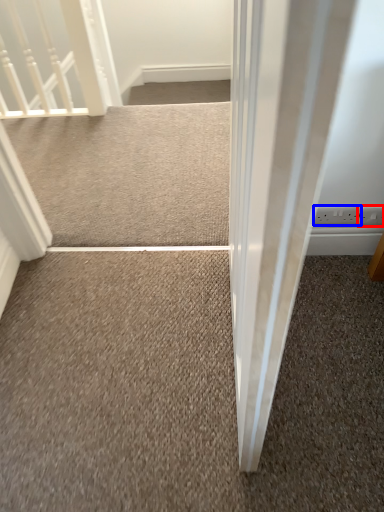
Question: Which point is further to the camera, electric outlet (highlighted by a red box) or electric outlet (highlighted by a blue box)?

Choices:
 (A) electric outlet
 (B) electric outlet

Answer: (B)